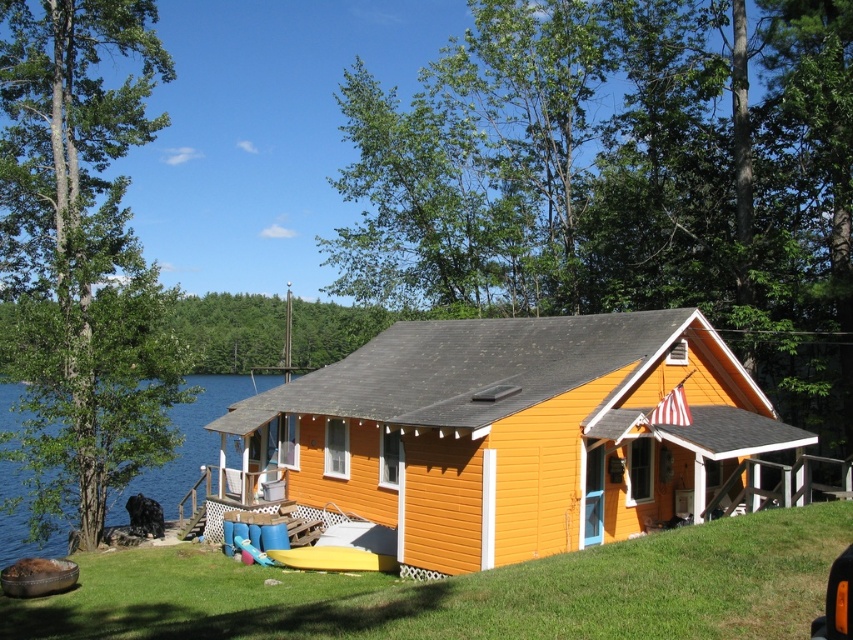
Question: Which point is closer to the camera taking this photo?

Choices:
 (A) (573, 332)
 (B) (1, 515)

Answer: (A)

Question: Observing the image, what is the correct spatial positioning of orange wood cabin at center in reference to blue water at left?

Choices:
 (A) above
 (B) below

Answer: (A)

Question: Observing the image, what is the correct spatial positioning of orange wood cabin at center in reference to blue water at left?

Choices:
 (A) below
 (B) above

Answer: (B)

Question: Which object is farther from the camera taking this photo?

Choices:
 (A) orange wood cabin at center
 (B) blue water at left

Answer: (B)

Question: Does orange wood cabin at center have a greater width compared to blue water at left?

Choices:
 (A) no
 (B) yes

Answer: (A)